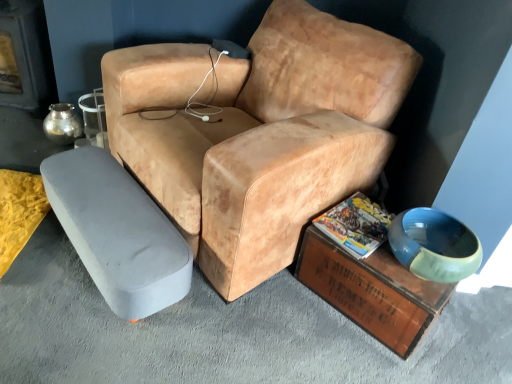
Find the location of a particular element. The width and height of the screenshot is (512, 384). vacant area on top of wooden crate at lower right, placed as the first table when sorted from right to left (from a real-world perspective) is located at coordinates (380, 248).